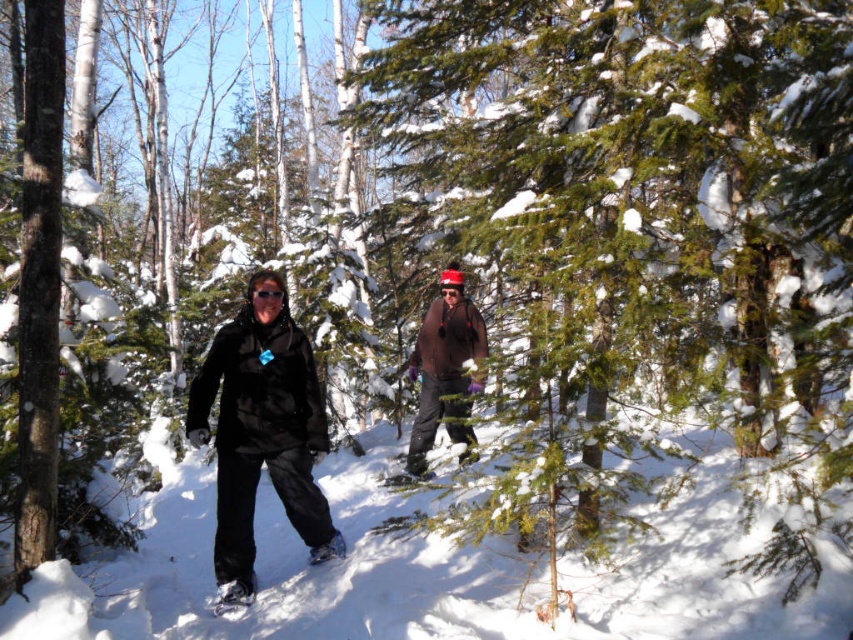
You are standing in the winter forest scene. You see the brown matte jacket at center and the white rubber snowshoe at lower left. Which object is positioned to the right of the other?

The brown matte jacket at center is to the right of white rubber snowshoe at lower left.

You are standing in the winter forest scene. There are two points marked in the image. The first point is at coordinates point (267,458) and the second point is at point (444,390). If you were to walk from the first point to the second point, would you be moving closer to or farther away from the camera?

The point at (267,458) is closer to the camera than the point at (444,390). Therefore, walking from the first point to the second point would mean moving farther away from the camera.

You are a hiker trying to decide which snowshoe to use. You notice the black matte snowshoes at center and the white rubber snowshoe at lower left. Which one is positioned to the right of the other?

The black matte snowshoes at center are to the right of the white rubber snowshoe at lower left.